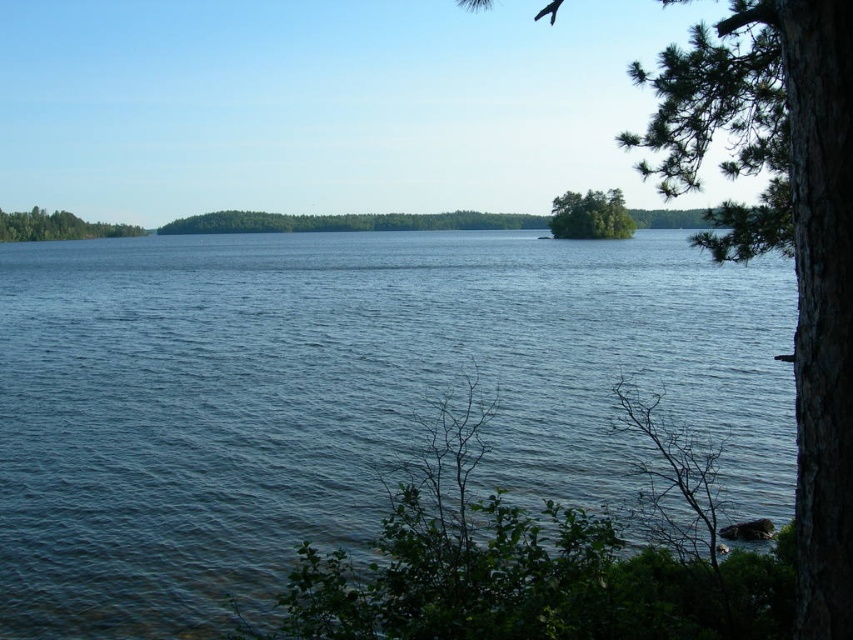
Looking at this image, you are standing at the lakeside and see two points marked in the image. Which point is closer to you, point (289, 218) or point (55, 228)?

Point (55, 228) is closer to you because it is less further to the camera than point (289, 218).

You are standing on the lakeside and see the blue water at center and the green textured tree at center right. Which object is closer to the water surface?

The blue water at center is located below the green textured tree at center right, so the blue water at center is closer to the water surface.

You are planning to place a small boat between the green textured tree at center right and the green leafy tree at left. Which tree has a wider base to anchor the boat more securely?

The green textured tree at center right has a wider width than the green leafy tree at left, so its base is wider and can anchor the boat more securely.